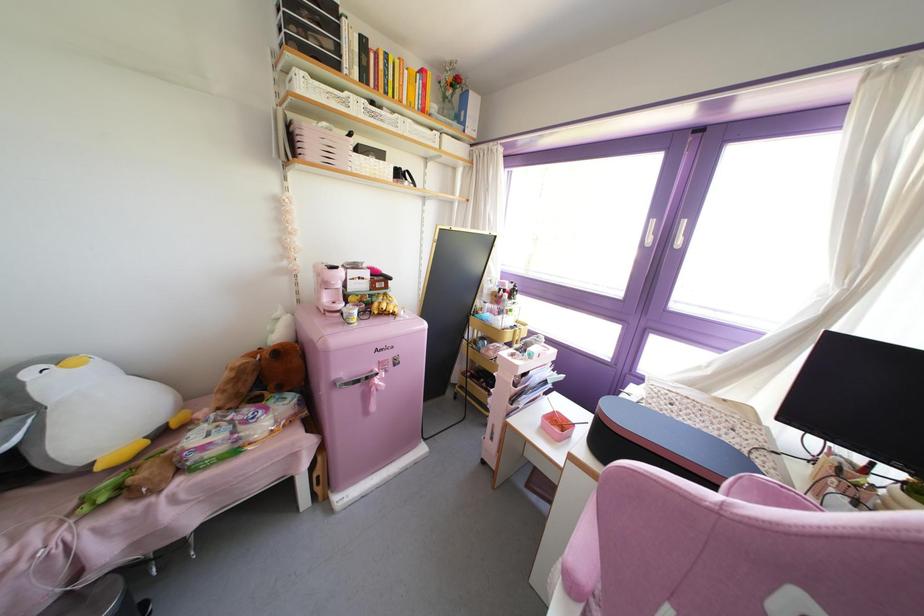
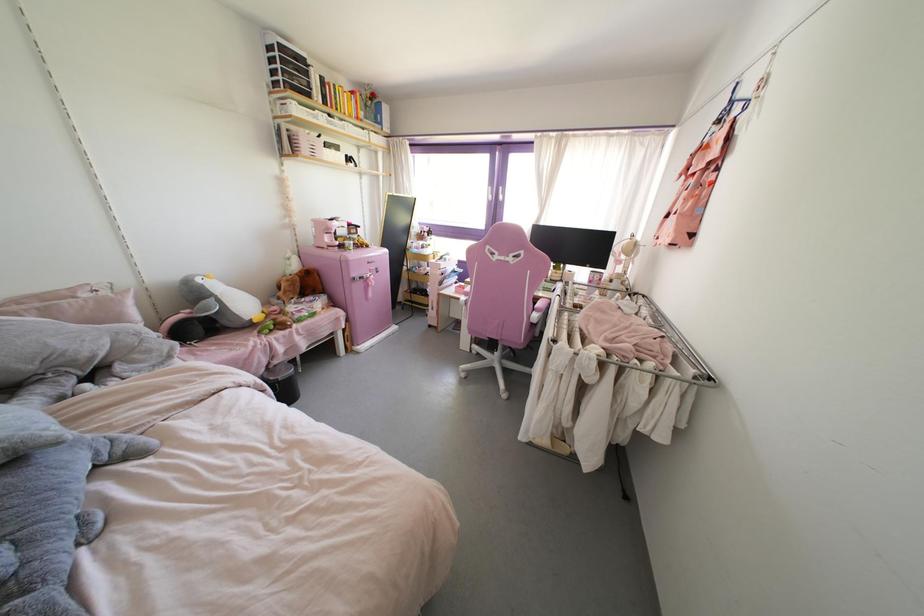
Locate, in the second image, the point that corresponds to (99,467) in the first image.

(254, 320)